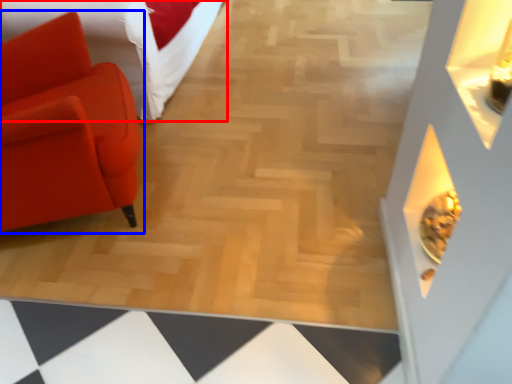
Question: Which object appears closest to the camera in this image, furniture (highlighted by a red box) or chair (highlighted by a blue box)?

Choices:
 (A) furniture
 (B) chair

Answer: (B)